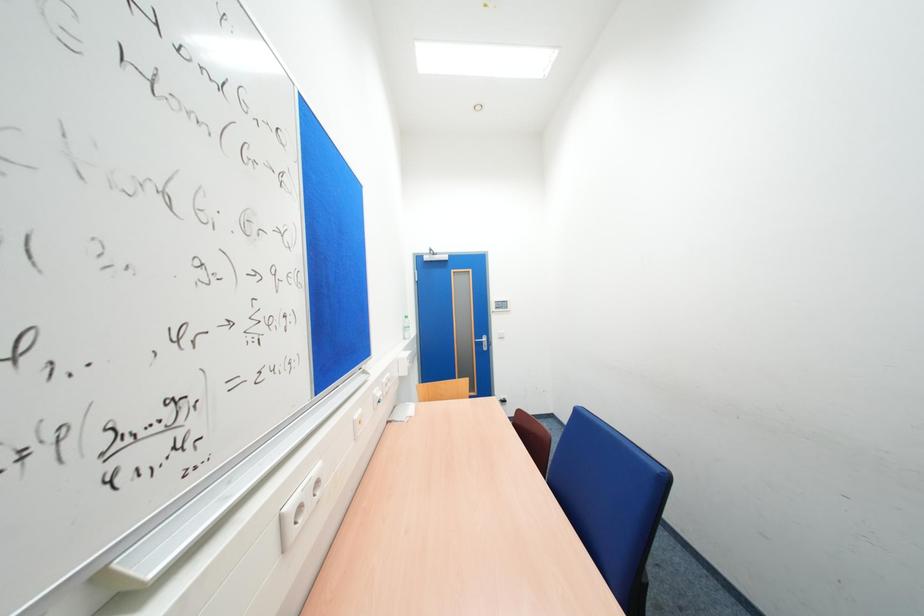
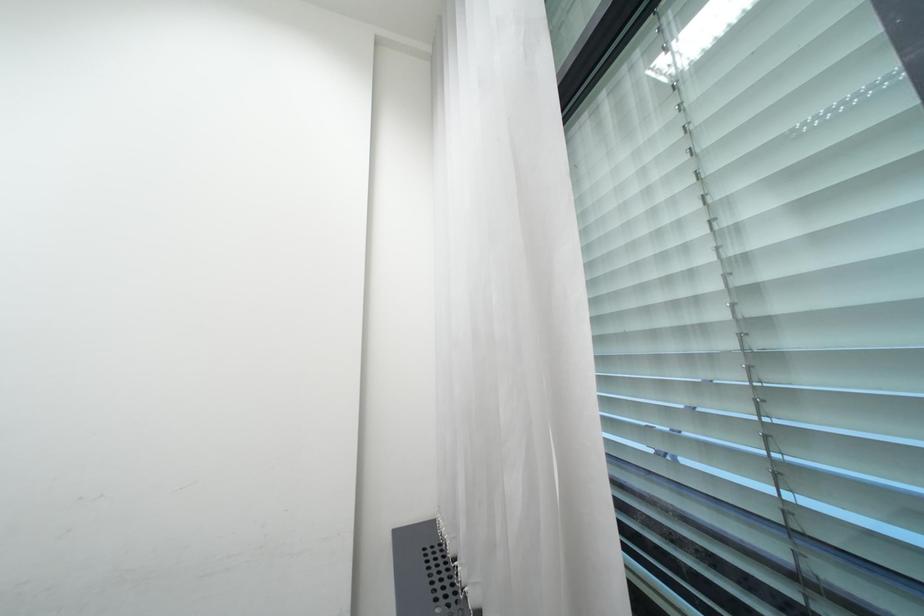
Question: Based on the continuous images, in which direction is the camera rotating? Reply with the corresponding letter.

Choices:
 (A) Left
 (B) Right
 (C) Up
 (D) Down

Answer: (B)